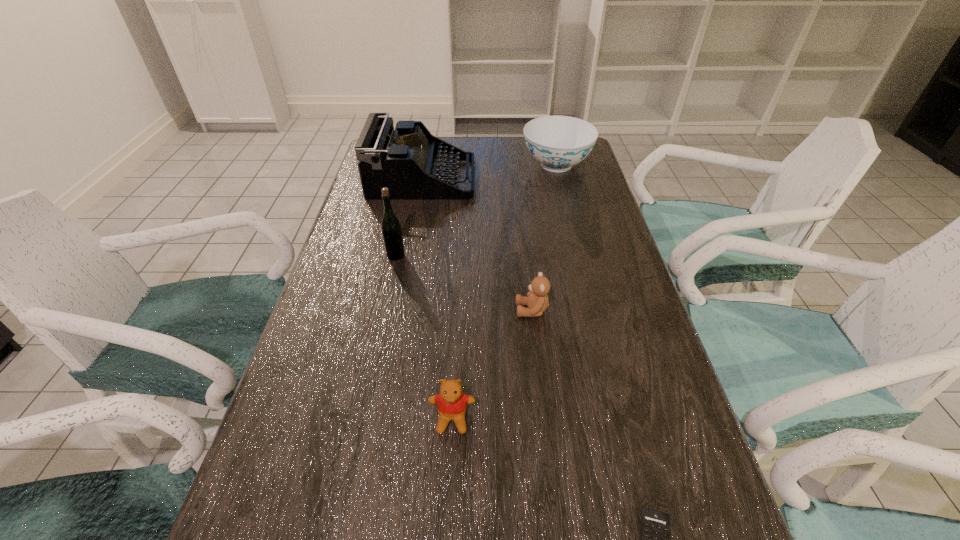
Image resolution: width=960 pixels, height=540 pixels. Find the location of `object present at the far right corner`. object present at the far right corner is located at coordinates (557, 142).

Find the location of a particular element. This screenshot has width=960, height=540. vacant area at the far edge of the desktop is located at coordinates (465, 141).

Identify the location of vacant region at the left edge of the desktop. Image resolution: width=960 pixels, height=540 pixels. (395, 201).

The height and width of the screenshot is (540, 960). I want to click on vacant area at the right edge of the desktop, so click(615, 278).

The width and height of the screenshot is (960, 540). In order to click on vacant point located between the second nearest object and the fourth nearest object in this screenshot , I will do `click(424, 337)`.

Where is `unoccupied position between the typewriter and the right teddy bear`? The height and width of the screenshot is (540, 960). unoccupied position between the typewriter and the right teddy bear is located at coordinates (477, 245).

Locate an element on the screen. The height and width of the screenshot is (540, 960). vacant area that lies between the nearer teddy bear and the third tallest object is located at coordinates (504, 292).

I want to click on vacant area that lies between the nearer teddy bear and the beer bottle, so click(424, 337).

Locate an element on the screen. Image resolution: width=960 pixels, height=540 pixels. vacant area that lies between the typewriter and the third tallest object is located at coordinates click(490, 172).

Locate an element on the screen. The width and height of the screenshot is (960, 540). empty location between the chinaware and the beer bottle is located at coordinates (476, 210).